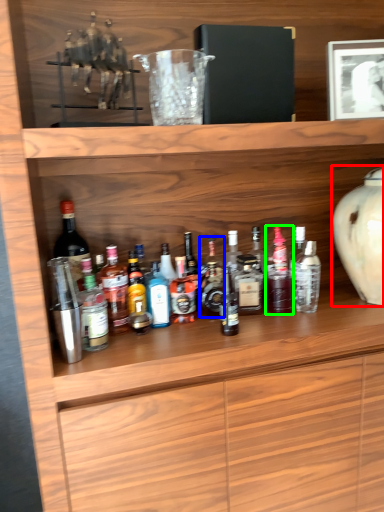
Question: Which object is the closest to the vase (highlighted by a red box)? Choose among these: bottle (highlighted by a blue box) or bottle (highlighted by a green box).

Choices:
 (A) bottle
 (B) bottle

Answer: (B)